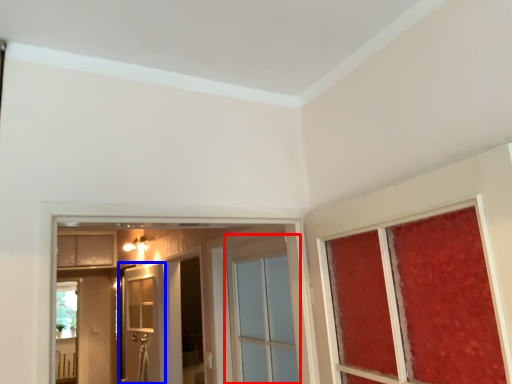
Question: Which object appears farthest to the camera in this image, door (highlighted by a red box) or door (highlighted by a blue box)?

Choices:
 (A) door
 (B) door

Answer: (B)